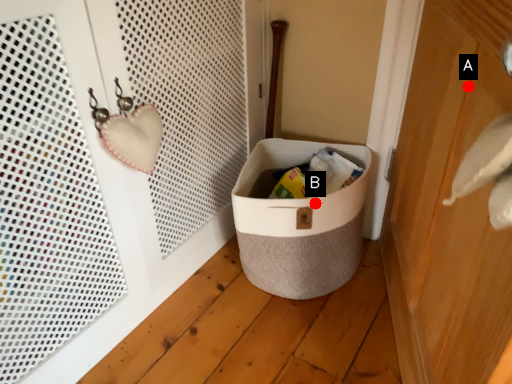
Question: Two points are circled on the image, labeled by A and B beside each circle. Which of the following is the farthest from the observer?

Choices:
 (A) A is further
 (B) B is further

Answer: (B)